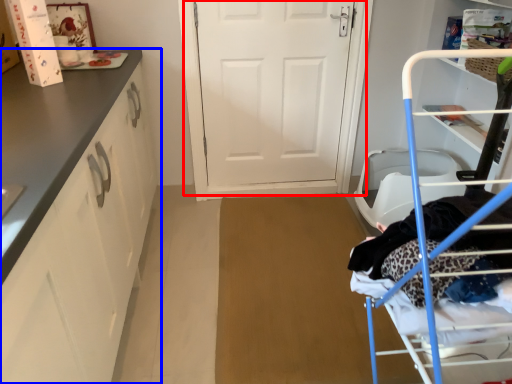
Question: Which of the following is the closest to the observer, door (highlighted by a red box) or cabinetry (highlighted by a blue box)?

Choices:
 (A) door
 (B) cabinetry

Answer: (B)